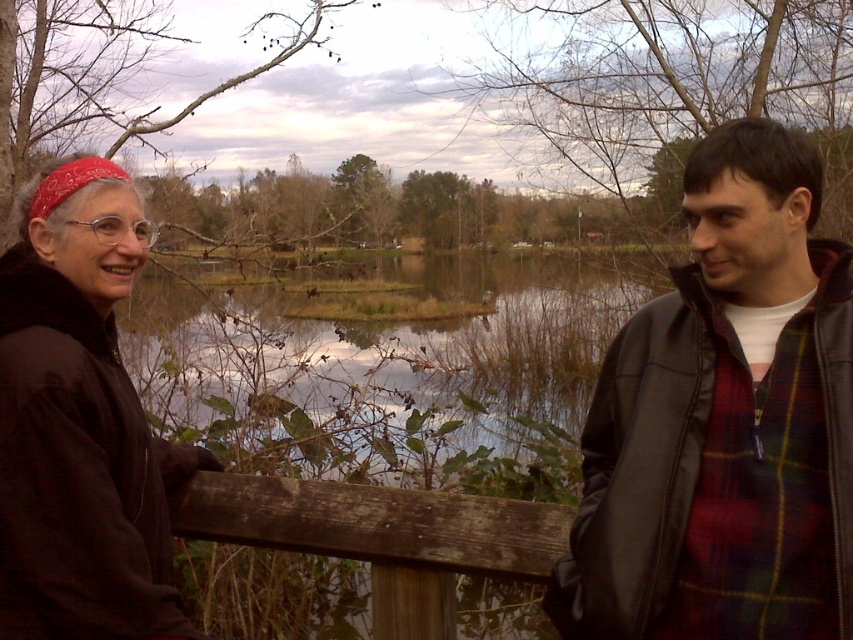
Find the location of a particular element. The image size is (853, 640). leather jacket at right is located at coordinates (724, 422).

Who is positioned more to the right, leather jacket at right or weathered wood fence at center?

Positioned to the right is leather jacket at right.

Does point (825, 618) come in front of point (416, 570)?

Yes, it is in front of point (416, 570).

The width and height of the screenshot is (853, 640). I want to click on leather jacket at right, so click(x=724, y=422).

Between matte black jacket at left and weathered wood fence at center, which one has more height?

Standing taller between the two is matte black jacket at left.

In the scene shown: Between matte black jacket at left and weathered wood fence at center, which one is positioned lower?

weathered wood fence at center is below.

Does point (85, 586) come behind point (521, 547)?

No, it is not.

Identify the location of matte black jacket at left. Image resolution: width=853 pixels, height=640 pixels. (80, 436).

Does leather jacket at right come behind matte black jacket at left?

No, leather jacket at right is closer to the viewer.

Can you confirm if leather jacket at right is wider than matte black jacket at left?

Correct, the width of leather jacket at right exceeds that of matte black jacket at left.

Where is `leather jacket at right`? The image size is (853, 640). leather jacket at right is located at coordinates (724, 422).